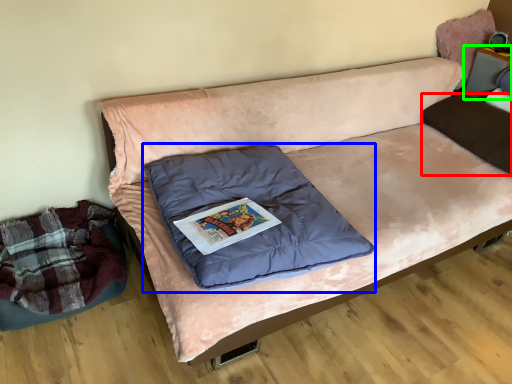
Question: Based on their relative distances, which object is nearer to pillow (highlighted by a red box)? Choose from pillow (highlighted by a blue box) and furniture (highlighted by a green box).

Choices:
 (A) pillow
 (B) furniture

Answer: (B)